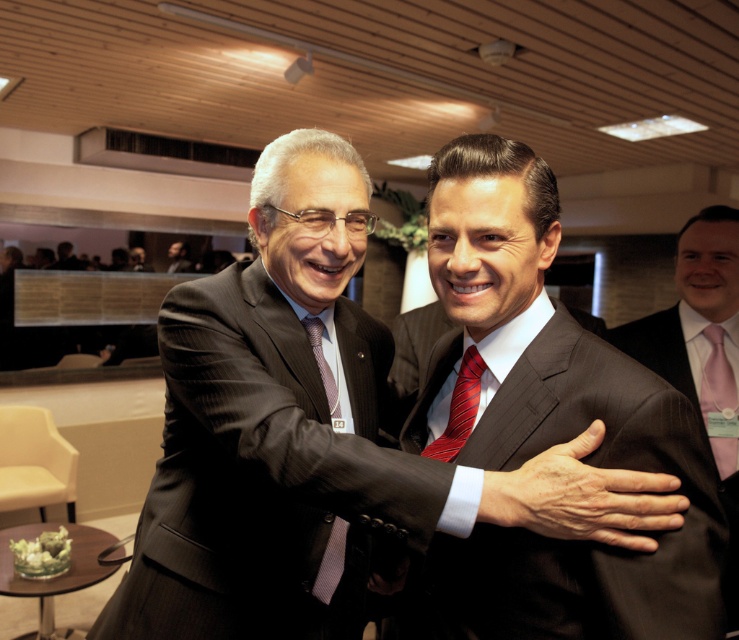
You are standing in the conference room and see two points marked in the image. Which point is closer to you, point (309,308) or point (321,387)?

Point (309,308) is closer to you than point (321,387) because it is further to the viewer according to the description.

You are a photographer at a conference event. You need to capture a photo of the two men wearing the dark pinstripe suit at center and the dark gray pinstripe suit at center. The camera you are using has a minimum focus distance of 1 inch. Can you take a clear photo of both suits without moving them?

The dark pinstripe suit at center is only 1.11 inches away from the dark gray pinstripe suit at center, which is within the camera minimum focus distance of 1 inch. Therefore, the camera can focus on both suits and take a clear photo without needing to move them.